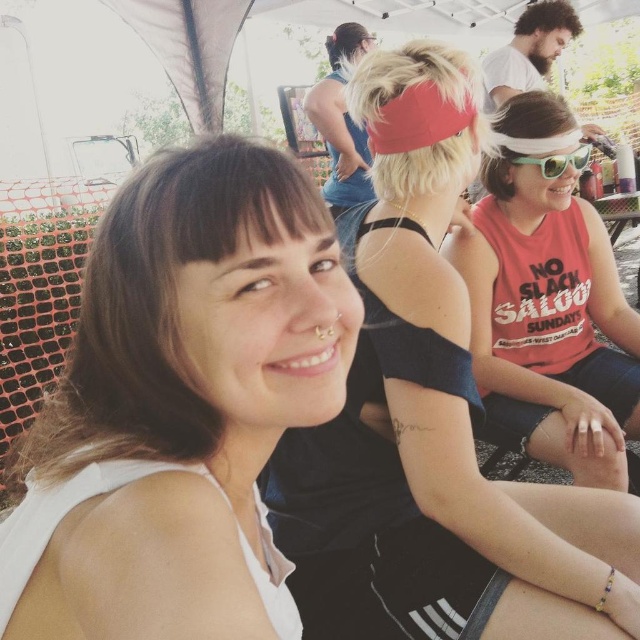
Question: From the image, what is the correct spatial relationship of black matte tank top at center in relation to matte red tank top at center?

Choices:
 (A) left
 (B) right

Answer: (A)

Question: Does matte red tank top at center have a smaller size compared to green plastic sunglasses at upper right?

Choices:
 (A) yes
 (B) no

Answer: (B)

Question: Among these objects, which one is farthest from the camera?

Choices:
 (A) green plastic sunglasses at upper right
 (B) matte red tank top at center

Answer: (A)

Question: Which point is farther to the camera?

Choices:
 (A) (90, 280)
 (B) (484, 182)

Answer: (B)

Question: Which object appears farthest from the camera in this image?

Choices:
 (A) white matte tank top at left
 (B) matte red tank top at center
 (C) green plastic sunglasses at upper right
 (D) black matte tank top at center

Answer: (C)

Question: Considering the relative positions of white matte tank top at left and black matte tank top at center in the image provided, where is white matte tank top at left located with respect to black matte tank top at center?

Choices:
 (A) above
 (B) below

Answer: (B)